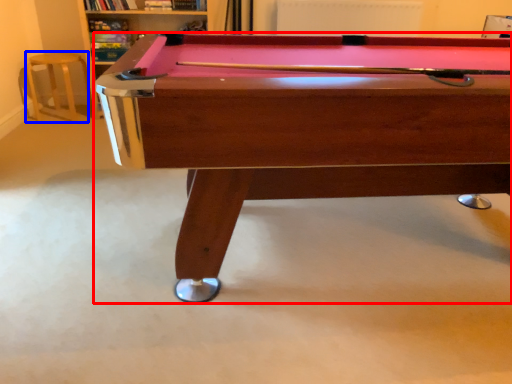
Question: Which of the following is the farthest to the observer, billiard table (highlighted by a red box) or bar stool (highlighted by a blue box)?

Choices:
 (A) billiard table
 (B) bar stool

Answer: (B)